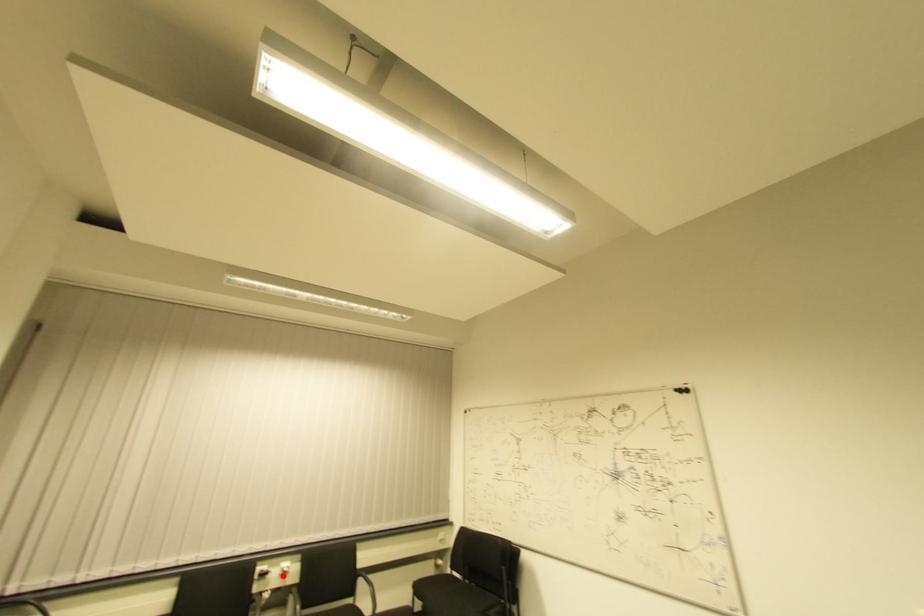
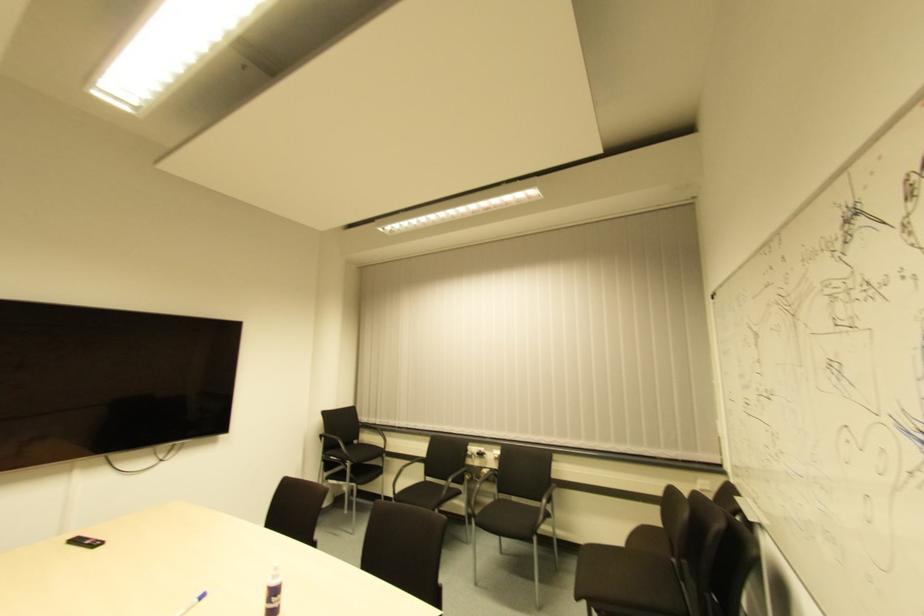
Question: I am providing you with two images of the same scene from different viewpoints. In image1, a red point is highlighted. Considering the same 3D point in image2, which of the following is correct?

Choices:
 (A) It is closer
 (B) It is farther

Answer: (B)